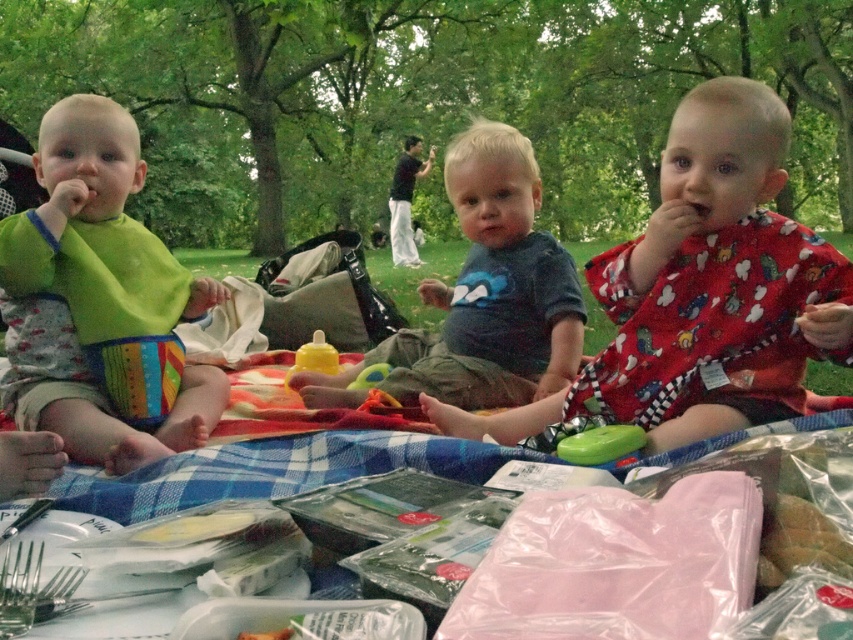
Based on the photo, can you confirm if red cotton bib at center is taller than blue cotton shirt at center?

Incorrect, red cotton bib at center's height is not larger of blue cotton shirt at center's.

How much distance is there between red cotton bib at center and blue cotton shirt at center?

red cotton bib at center is 16.22 inches away from blue cotton shirt at center.

Is point (807, 273) positioned behind point (486, 259)?

No, it is in front of (486, 259).

Find the location of a particular element. Image resolution: width=853 pixels, height=640 pixels. red cotton bib at center is located at coordinates (701, 291).

Who is positioned more to the right, blue cotton shirt at center or green plastic toy at center?

green plastic toy at center is more to the right.

Which is more to the left, blue cotton shirt at center or green plastic toy at center?

Positioned to the left is blue cotton shirt at center.

Which is in front, point (331, 384) or point (589, 460)?

Point (589, 460)

The height and width of the screenshot is (640, 853). I want to click on blue cotton shirt at center, so click(485, 294).

Can you confirm if green plastic toy at center is positioned below translucent rubber sippy cup at center?

Yes.

Looking at this image, is green plastic toy at center bigger than translucent rubber sippy cup at center?

Yes.

What do you see at coordinates (601, 444) in the screenshot?
I see `green plastic toy at center` at bounding box center [601, 444].

Find the location of a particular element. The width and height of the screenshot is (853, 640). green plastic toy at center is located at coordinates (601, 444).